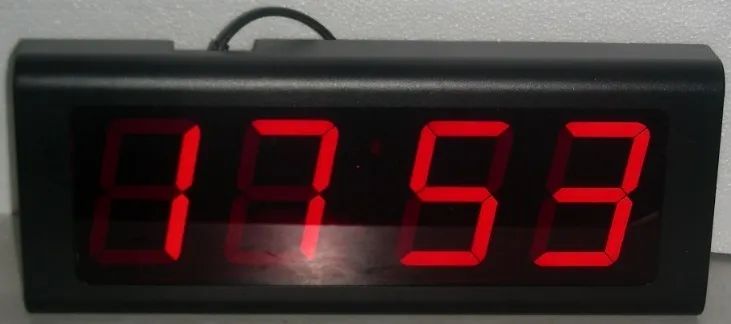
The width and height of the screenshot is (731, 324). What are the coordinates of `clock` in the screenshot? It's located at (136, 176).